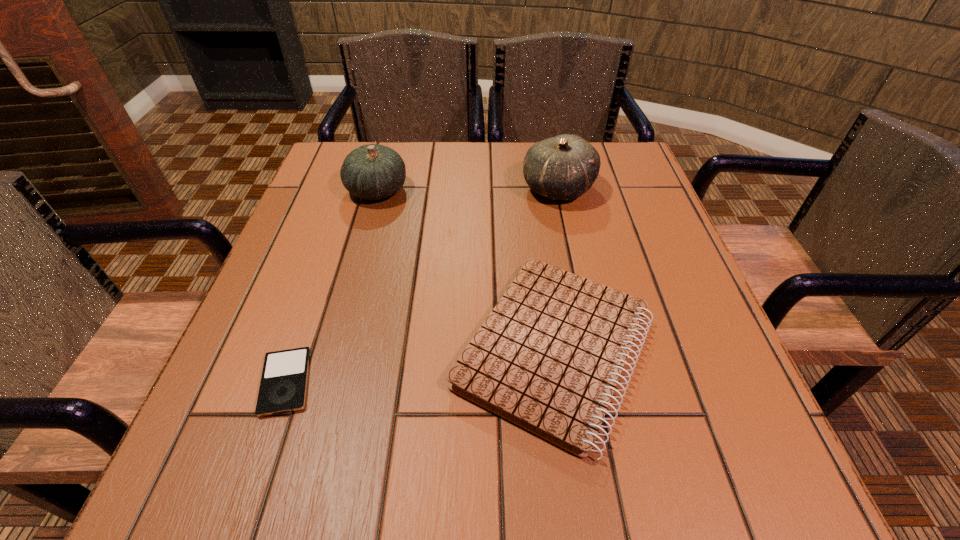
You are a GUI agent. You are given a task and a screenshot of the screen. Output one action in this format:
    pyautogui.click(x=<x>, y=<y>)
    Task: Click on the free point at the near left corner
    The image size is (960, 540).
    Given the screenshot: What is the action you would take?
    pyautogui.click(x=163, y=499)

The image size is (960, 540). In the image, there is a desktop. Find the location of `blank space at the near right corner`. blank space at the near right corner is located at coordinates (753, 469).

Locate an element on the screen. Image resolution: width=960 pixels, height=540 pixels. empty space that is in between the notebook and the iPod is located at coordinates (420, 366).

The image size is (960, 540). I want to click on free space between the shortest object and the notebook, so click(420, 366).

At what (x,y) coordinates should I click in order to perform the action: click on vacant area between the shortest object and the left gourd. Please return your answer as a coordinate pair (x, y). The height and width of the screenshot is (540, 960). Looking at the image, I should click on (331, 286).

At what (x,y) coordinates should I click in order to perform the action: click on free spot between the iPod and the notebook. Please return your answer as a coordinate pair (x, y). The height and width of the screenshot is (540, 960). Looking at the image, I should click on (420, 366).

Locate an element on the screen. This screenshot has height=540, width=960. free space between the iPod and the notebook is located at coordinates (420, 366).

The image size is (960, 540). In order to click on empty location between the iPod and the left gourd in this screenshot , I will do `click(331, 286)`.

Where is `free space between the notebook and the left gourd`? This screenshot has height=540, width=960. free space between the notebook and the left gourd is located at coordinates (466, 270).

This screenshot has height=540, width=960. What are the coordinates of `free point between the left gourd and the iPod` in the screenshot? It's located at (331, 286).